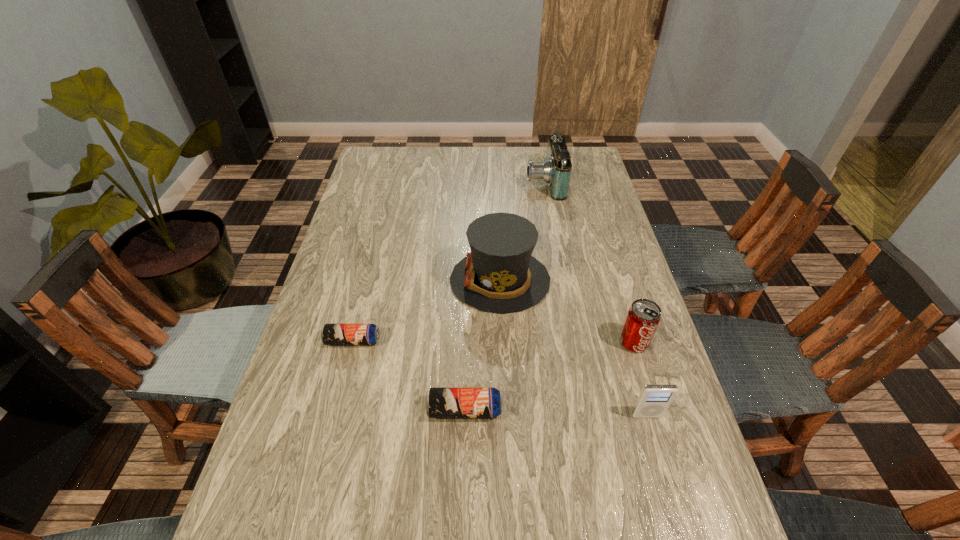
This screenshot has width=960, height=540. In the image, there is a desktop. In order to click on free space at the near left corner in this screenshot , I will do `click(258, 504)`.

Locate an element on the screen. This screenshot has height=540, width=960. vacant area between the fifth tallest object and the iPod is located at coordinates (556, 413).

The height and width of the screenshot is (540, 960). What are the coordinates of `empty space that is in between the farthest object and the shortest object` in the screenshot? It's located at (448, 261).

What are the coordinates of `free space between the farther beer can and the pop soda` in the screenshot? It's located at (493, 341).

Identify the location of free spot between the leftmost object and the camcorder. This screenshot has height=540, width=960. (448, 261).

The height and width of the screenshot is (540, 960). I want to click on vacant space that's between the second shortest object and the iPod, so click(x=556, y=413).

This screenshot has width=960, height=540. Identify the location of vacant region between the pop soda and the farther beer can. (493, 341).

Where is `free space that is in between the farthest object and the pop soda`? The width and height of the screenshot is (960, 540). free space that is in between the farthest object and the pop soda is located at coordinates (589, 262).

Identify the location of vacant area that lies between the leftmost object and the pop soda. (493, 341).

Where is `the second closest object to the fifth nearest object`? Image resolution: width=960 pixels, height=540 pixels. the second closest object to the fifth nearest object is located at coordinates (331, 334).